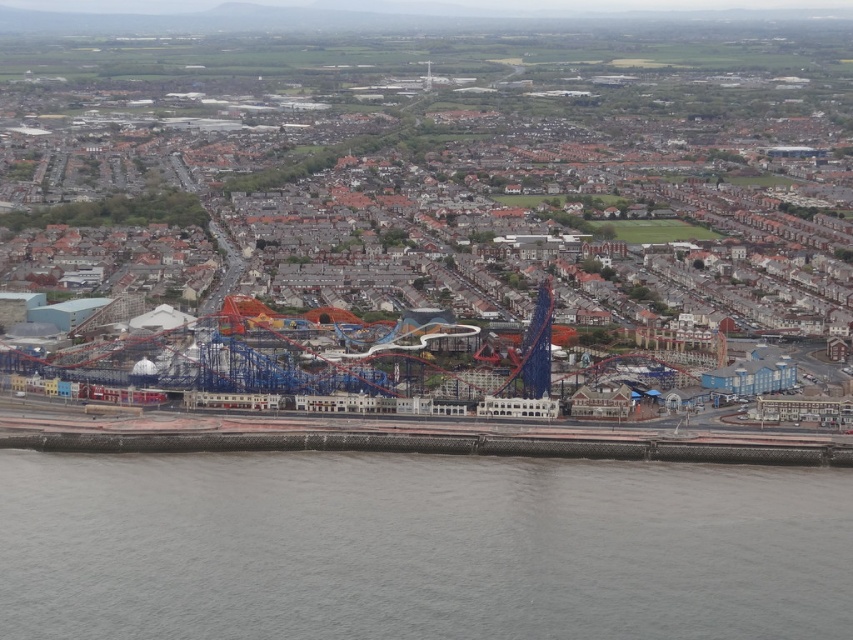
Question: Is the position of blue metallic roller coaster at center more distant than that of gray concrete wall at lower center?

Choices:
 (A) no
 (B) yes

Answer: (A)

Question: Which object appears farthest from the camera in this image?

Choices:
 (A) blue metallic roller coaster at center
 (B) gray concrete wall at lower center

Answer: (B)

Question: Can you confirm if blue metallic roller coaster at center is positioned above gray concrete wall at lower center?

Choices:
 (A) no
 (B) yes

Answer: (B)

Question: Which of the following is the farthest from the observer?

Choices:
 (A) (537, 346)
 (B) (770, 552)

Answer: (B)

Question: Can you confirm if blue metallic roller coaster at center is smaller than gray concrete wall at lower center?

Choices:
 (A) yes
 (B) no

Answer: (B)